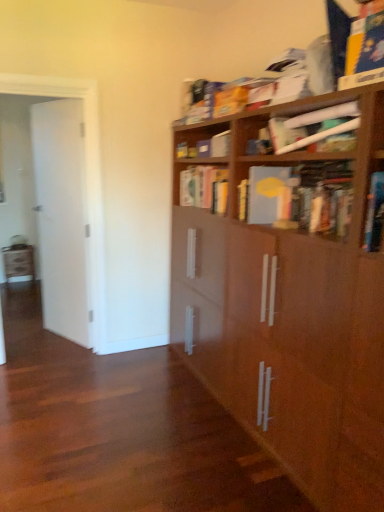
Question: Does white glossy door at left lie behind yellow matte book at center, the first book in the back-to-front sequence?

Choices:
 (A) yes
 (B) no

Answer: (A)

Question: Is white glossy door at left wider than yellow matte book at center, the first book in the back-to-front sequence?

Choices:
 (A) no
 (B) yes

Answer: (A)

Question: Does white glossy door at left come in front of yellow matte book at center, the first book in the back-to-front sequence?

Choices:
 (A) no
 (B) yes

Answer: (A)

Question: From a real-world perspective, is white glossy door at left beneath yellow matte book at center, which is counted as the 3th book, starting from the front?

Choices:
 (A) no
 (B) yes

Answer: (B)

Question: Is white glossy door at left shorter than yellow matte book at center, the first book in the back-to-front sequence?

Choices:
 (A) yes
 (B) no

Answer: (B)

Question: Considering the positions of point (249, 169) and point (190, 189), is point (249, 169) closer or farther from the camera than point (190, 189)?

Choices:
 (A) farther
 (B) closer

Answer: (B)

Question: Is matte gray book at upper right, arranged as the 2th book when viewed from the back, taller or shorter than yellow matte book at center, the first book in the back-to-front sequence?

Choices:
 (A) short
 (B) tall

Answer: (A)

Question: In terms of width, does matte gray book at upper right, arranged as the 2th book when viewed from the back, look wider or thinner when compared to yellow matte book at center, which is counted as the 3th book, starting from the front?

Choices:
 (A) thin
 (B) wide

Answer: (B)

Question: Relative to yellow matte book at center, which is counted as the 3th book, starting from the front, is matte gray book at upper right, arranged as the 2th book when viewed from the back, in front or behind?

Choices:
 (A) front
 (B) behind

Answer: (A)

Question: From their relative heights in the image, would you say yellow matte book at center, the first book in the back-to-front sequence, is taller or shorter than matte gray book at upper right, acting as the second book starting from the front?

Choices:
 (A) short
 (B) tall

Answer: (B)

Question: From the image's perspective, is yellow matte book at center, the first book in the back-to-front sequence, above or below matte gray book at upper right, acting as the second book starting from the front?

Choices:
 (A) above
 (B) below

Answer: (A)

Question: In the image, is yellow matte book at center, which is counted as the 3th book, starting from the front, on the left side or the right side of matte gray book at upper right, arranged as the 2th book when viewed from the back?

Choices:
 (A) left
 (B) right

Answer: (A)

Question: Looking at the image, does yellow matte book at center, which is counted as the 3th book, starting from the front, seem bigger or smaller compared to matte gray book at upper right, acting as the second book starting from the front?

Choices:
 (A) big
 (B) small

Answer: (B)

Question: From a real-world perspective, is matte gray book at upper right, acting as the second book starting from the front, physically located above or below white glossy door at left?

Choices:
 (A) below
 (B) above

Answer: (B)

Question: Is point (342, 217) positioned closer to the camera than point (36, 104)?

Choices:
 (A) closer
 (B) farther

Answer: (A)